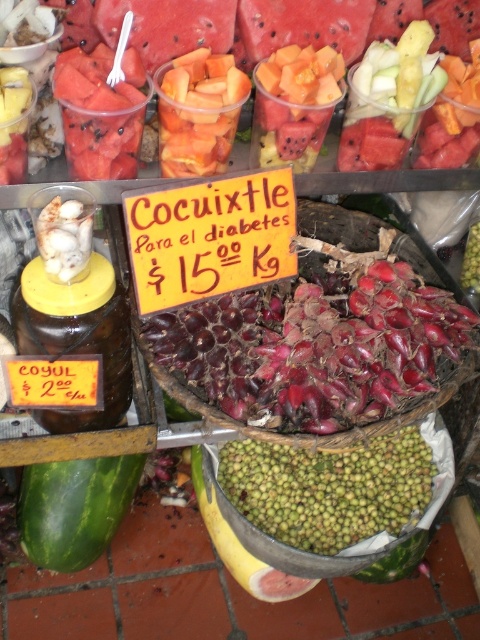
Is point (391, 518) behind point (187, 93)?

Yes, point (391, 518) is behind point (187, 93).

Who is positioned more to the left, green matte seeds at center or orange fleshed at center?

From the viewer's perspective, orange fleshed at center appears more on the left side.

At what (x,y) coordinates should I click in order to perform the action: click on green matte seeds at center. Please return your answer as a coordinate pair (x, y). Looking at the image, I should click on (328, 490).

Who is higher up, shiny red onion at center or green matte seeds at center?

shiny red onion at center

Does shiny red onion at center have a smaller size compared to green matte seeds at center?

Incorrect, shiny red onion at center is not smaller in size than green matte seeds at center.

I want to click on shiny red onion at center, so click(312, 349).

At what (x,y) coordinates should I click in order to perform the action: click on shiny red onion at center. Please return your answer as a coordinate pair (x, y). Looking at the image, I should click on (312, 349).

Who is more distant from viewer, (360, 417) or (204, 173)?

The point (204, 173) is more distant.

Is shiny red onion at center to the left of orange fleshed at center from the viewer's perspective?

Incorrect, shiny red onion at center is not on the left side of orange fleshed at center.

Does point (302, 275) come farther from viewer compared to point (216, 129)?

Yes.

Where is `shiny red onion at center`? shiny red onion at center is located at coordinates (312, 349).